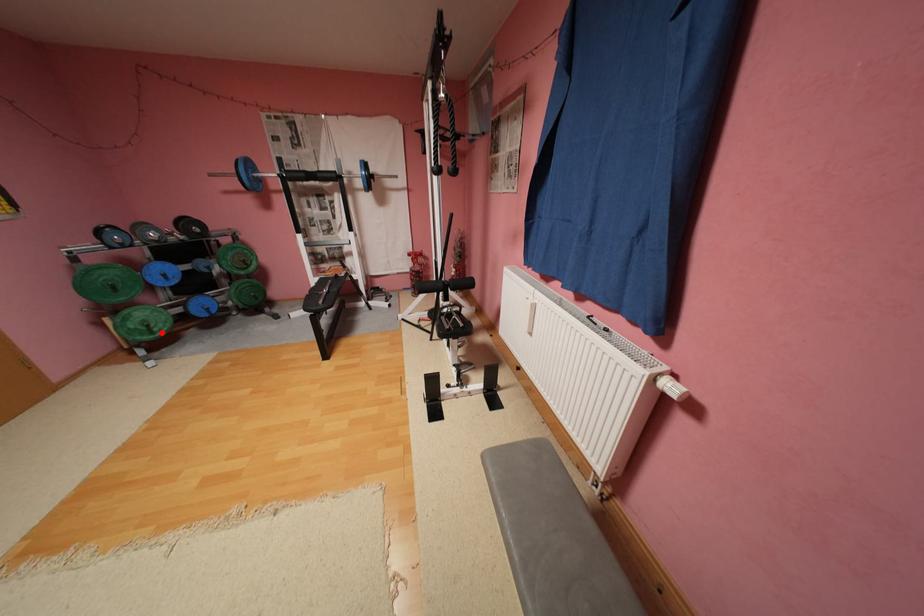
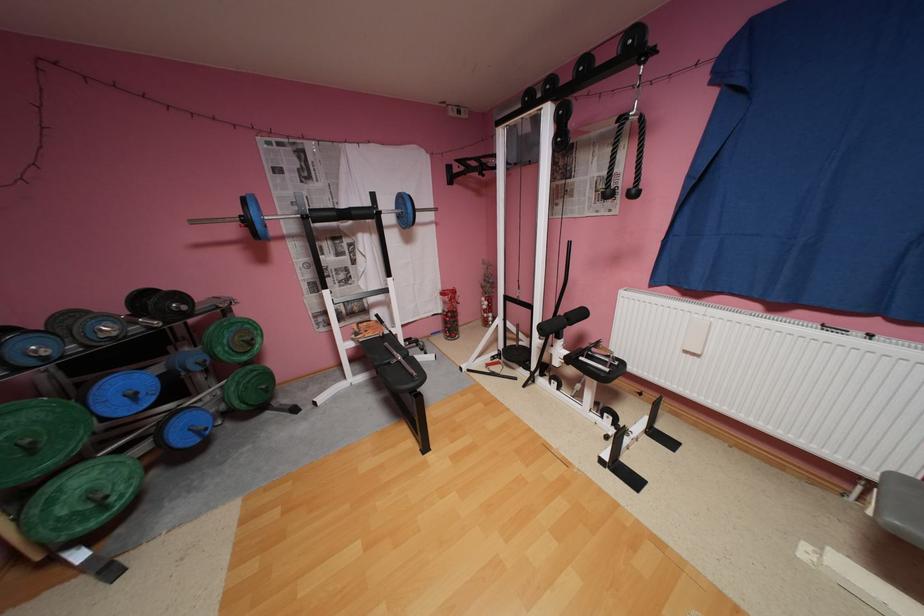
Question: A red point is marked in image1. In image2, is the corresponding 3D point closer to the camera or farther? Reply with the corresponding letter.

Choices:
 (A) The corresponding 3D point is closer.
 (B) The corresponding 3D point is farther.

Answer: (A)